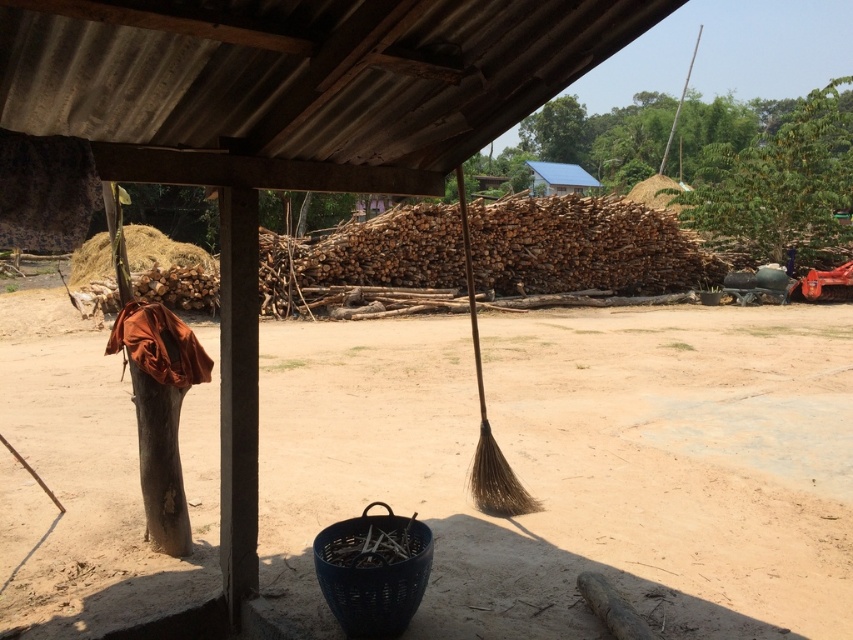
Question: Does brown dirt field at center have a greater width compared to brown natural fiber broom at center?

Choices:
 (A) no
 (B) yes

Answer: (B)

Question: Considering the relative positions of brown dirt field at center and brown natural fiber broom at center in the image provided, where is brown dirt field at center located with respect to brown natural fiber broom at center?

Choices:
 (A) right
 (B) left

Answer: (A)

Question: Among these objects, which one is nearest to the camera?

Choices:
 (A) brown dirt field at center
 (B) brown natural fiber broom at center

Answer: (A)

Question: Is brown dirt field at center bigger than brown natural fiber broom at center?

Choices:
 (A) no
 (B) yes

Answer: (B)

Question: Among these points, which one is nearest to the camera?

Choices:
 (A) (482, 428)
 (B) (346, 339)

Answer: (A)